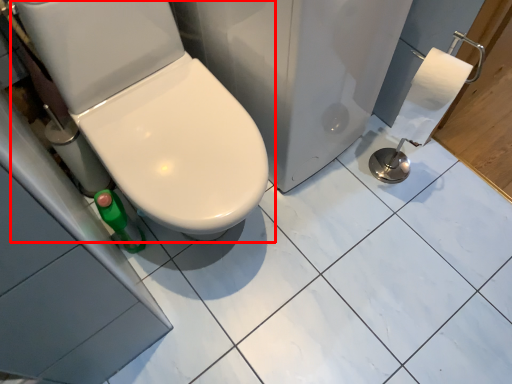
Question: Where is toilet (annotated by the red box) located in relation to porcelain in the image?

Choices:
 (A) right
 (B) left

Answer: (B)